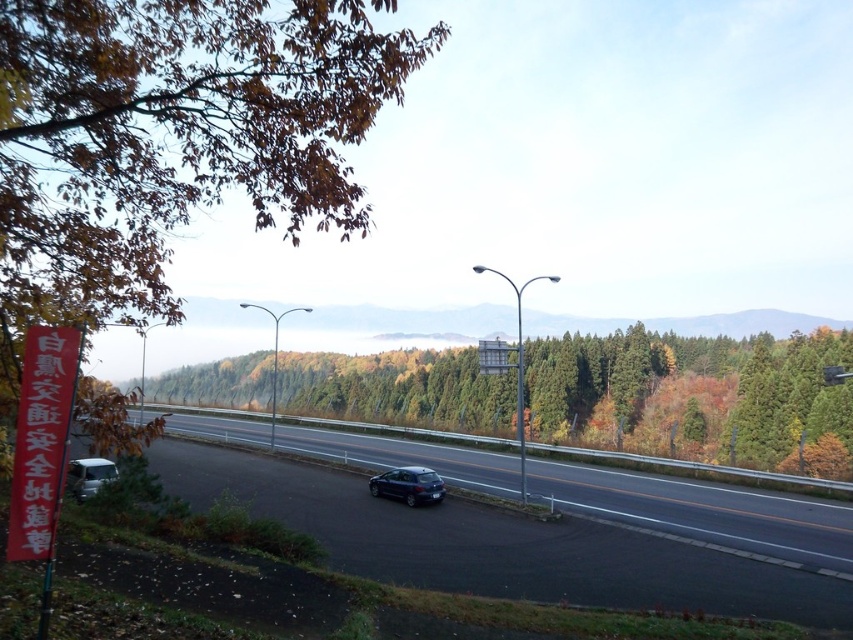
Looking at this image, you are a driver approaching the highway and notice a red banner with white Japanese characters on the left side of the road. As you look ahead, you see a brown leafy tree at upper left and a green matte tree at center. Which tree has a narrower trunk?

The brown leafy tree at upper left is thinner than the green matte tree at center, so the brown leafy tree at upper left has a narrower trunk.

You are a driver approaching the highway shown in the image. You notice two points marked on the road ahead. Which point, point (683, 534) or point (173, 372), is closer to your current position?

Point (683, 534) is closer to the viewer than point (173, 372), so the point closer to your current position is point (683, 534).

You are a hiker standing at the edge of the forest looking towards the highway. You notice a brown leafy tree at upper left and a green matte tree at center. Which tree is closer to you?

The brown leafy tree at upper left is closer to you because it is in front of the green matte tree at center.